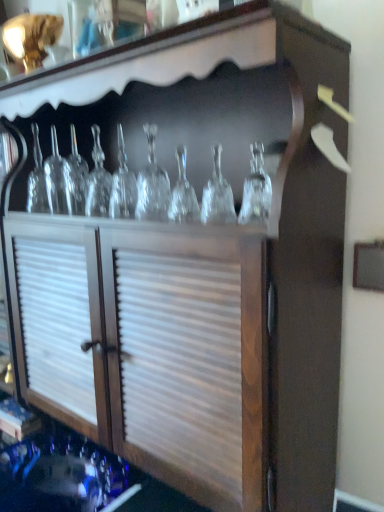
Question: Is point 137,188 positioned closer to the camera than point 56,195?

Choices:
 (A) farther
 (B) closer

Answer: (B)

Question: Considering the positions of transparent glass wine glass at center, which is the second glass bottle from back to front, and clear glass bottle at left, marked as the second glass bottle in a right-to-left arrangement, in the image, is transparent glass wine glass at center, which is the second glass bottle from back to front, taller or shorter than clear glass bottle at left, marked as the second glass bottle in a right-to-left arrangement,?

Choices:
 (A) short
 (B) tall

Answer: (B)

Question: In the image, is transparent glass wine glass at center, acting as the first glass bottle starting from the front, on the left side or the right side of clear glass bottle at left, which is the 2th glass bottle from front to back?

Choices:
 (A) right
 (B) left

Answer: (A)

Question: Is point (62, 185) closer or farther from the camera than point (144, 131)?

Choices:
 (A) closer
 (B) farther

Answer: (B)

Question: Considering the relative positions of clear glass bottle at left, acting as the first glass bottle starting from the back, and transparent glass wine glass at center, which is the second glass bottle from back to front, in the image provided, is clear glass bottle at left, acting as the first glass bottle starting from the back, to the left or to the right of transparent glass wine glass at center, which is the second glass bottle from back to front,?

Choices:
 (A) right
 (B) left

Answer: (B)

Question: In terms of width, does clear glass bottle at left, which is the 2th glass bottle from front to back, look wider or thinner when compared to transparent glass wine glass at center, which is the second glass bottle from back to front?

Choices:
 (A) thin
 (B) wide

Answer: (B)

Question: Which is correct: clear glass bottle at left, which is the 2th glass bottle from front to back, is inside transparent glass wine glass at center, acting as the first glass bottle starting from the front, or outside of it?

Choices:
 (A) inside
 (B) outside

Answer: (B)